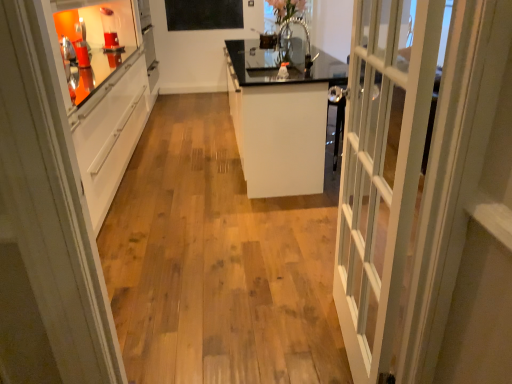
What do you see at coordinates (280, 120) in the screenshot? I see `white glossy cabinet at center` at bounding box center [280, 120].

I want to click on white glossy cabinet at center, so click(280, 120).

In order to face white glossy cabinet at left, should I rotate leftwards or rightwards?

Turn left approximately 19.706 degrees to face it.

This screenshot has width=512, height=384. What do you see at coordinates (204, 14) in the screenshot? I see `black matte bulletin board at upper center` at bounding box center [204, 14].

Find the location of `white glossy cabinet at center`. white glossy cabinet at center is located at coordinates (280, 120).

Choose the correct answer: Is white glossy cabinet at center inside clear glass vase at upper center or outside it?

white glossy cabinet at center is spatially situated outside clear glass vase at upper center.

Can you confirm if white glossy cabinet at center is bigger than clear glass vase at upper center?

Yes, white glossy cabinet at center is bigger than clear glass vase at upper center.

At what (x,y) coordinates should I click in order to perform the action: click on window screen above the white glossy cabinet at center (from the image's perspective). Please return your answer as a coordinate pair (x, y). This screenshot has height=384, width=512. Looking at the image, I should click on (287, 10).

Considering the sizes of objects white glossy cabinet at center and clear glass vase at upper center in the image provided, who is wider, white glossy cabinet at center or clear glass vase at upper center?

white glossy cabinet at center is wider.

How many degrees apart are the facing directions of clear glass vase at upper center and white glossy cabinet at center?

179 degrees separate the facing orientations of clear glass vase at upper center and white glossy cabinet at center.

Locate an element on the screen. cabinetry that is under the clear glass vase at upper center (from a real-world perspective) is located at coordinates (280, 120).

Does clear glass vase at upper center come behind white glossy cabinet at center?

Yes, clear glass vase at upper center is further from the camera.

Is clear glass vase at upper center to the left or to the right of white glossy cabinet at center in the image?

clear glass vase at upper center is positioned on white glossy cabinet at center's right side.

Are clear glass vase at upper center and black matte bulletin board at upper center far apart?

Yes, clear glass vase at upper center and black matte bulletin board at upper center are quite far apart.

Considering the positions of points (288, 4) and (210, 15), is point (288, 4) closer to camera compared to point (210, 15)?

That is True.

This screenshot has height=384, width=512. Find the location of `bulletin board behind the clear glass vase at upper center`. bulletin board behind the clear glass vase at upper center is located at coordinates (204, 14).

Is point (180, 2) behind point (313, 181)?

Yes, point (180, 2) is behind point (313, 181).

How many degrees apart are the facing directions of black matte bulletin board at upper center and white glossy cabinet at center?

The angle between the facing direction of black matte bulletin board at upper center and the facing direction of white glossy cabinet at center is 89.2 degrees.

Locate an element on the screen. cabinetry in front of the black matte bulletin board at upper center is located at coordinates (280, 120).

Is black matte bulletin board at upper center wider than white glossy cabinet at center?

In fact, black matte bulletin board at upper center might be narrower than white glossy cabinet at center.

Is point (29, 159) more distant than point (298, 106)?

No, (29, 159) is closer to viewer.

From the image's perspective, relative to white glossy cabinet at center, is white glossy cabinet at left above or below?

Based on their image positions, white glossy cabinet at left is located above white glossy cabinet at center.

At what (x,y) coordinates should I click in order to perform the action: click on door on the left of white glossy cabinet at center. Please return your answer as a coordinate pair (x, y). Looking at the image, I should click on (45, 224).

Can you confirm if white glossy cabinet at center is wider than black matte bulletin board at upper center?

Yes.

Who is bigger, white glossy cabinet at center or black matte bulletin board at upper center?

Bigger between the two is white glossy cabinet at center.

Is black matte bulletin board at upper center far away from clear glass vase at upper center?

black matte bulletin board at upper center is positioned a significant distance from clear glass vase at upper center.

Is black matte bulletin board at upper center turned away from clear glass vase at upper center?

No, black matte bulletin board at upper center is not facing away from clear glass vase at upper center.

From a real-world perspective, is black matte bulletin board at upper center over clear glass vase at upper center?

No, from a real-world perspective, black matte bulletin board at upper center is not over clear glass vase at upper center

At what (x,y) coordinates should I click in order to perform the action: click on cabinetry on the left of the clear glass vase at upper center. Please return your answer as a coordinate pair (x, y). The image size is (512, 384). Looking at the image, I should click on (280, 120).

Locate an element on the screen. window screen behind the white glossy cabinet at center is located at coordinates (287, 10).

Looking at the image, which one is located closer to white glossy cabinet at center, clear glass vase at upper center or white glossy cabinet at left?

clear glass vase at upper center is positioned closer to the anchor white glossy cabinet at center.

Which object lies further to the anchor point clear glass vase at upper center, white glossy cabinet at left or black matte bulletin board at upper center?

black matte bulletin board at upper center is further to clear glass vase at upper center.

In the scene shown: Looking at the image, which one is located closer to white glossy cabinet at left, white glossy cabinet at center or black matte bulletin board at upper center?

The object closer to white glossy cabinet at left is white glossy cabinet at center.

Estimate the real-world distances between objects in this image. Which object is closer to black matte bulletin board at upper center, white glossy cabinet at center or white glossy cabinet at left?

The object closer to black matte bulletin board at upper center is white glossy cabinet at center.

Which object lies nearer to the anchor point clear glass vase at upper center, black matte bulletin board at upper center or white glossy cabinet at left?

Among the two, white glossy cabinet at left is located nearer to clear glass vase at upper center.

Estimate the real-world distances between objects in this image. Which object is closer to white glossy cabinet at left, white glossy cabinet at center or clear glass vase at upper center?

white glossy cabinet at center.

In the scene shown: Based on their spatial positions, is black matte bulletin board at upper center or white glossy cabinet at center closer to clear glass vase at upper center?

white glossy cabinet at center.

Estimate the real-world distances between objects in this image. Which object is further from black matte bulletin board at upper center, clear glass vase at upper center or white glossy cabinet at center?

The object further to black matte bulletin board at upper center is clear glass vase at upper center.

In order to click on window screen positioned between white glossy cabinet at center and black matte bulletin board at upper center from near to far in this screenshot , I will do `click(287, 10)`.

In order to click on cabinetry between white glossy cabinet at left and black matte bulletin board at upper center from front to back in this screenshot , I will do `click(280, 120)`.

Identify the location of cabinetry between white glossy cabinet at left and clear glass vase at upper center in the front-back direction. (280, 120).

At what (x,y) coordinates should I click in order to perform the action: click on window screen between white glossy cabinet at left and black matte bulletin board at upper center along the z-axis. Please return your answer as a coordinate pair (x, y). This screenshot has height=384, width=512. Looking at the image, I should click on (287, 10).